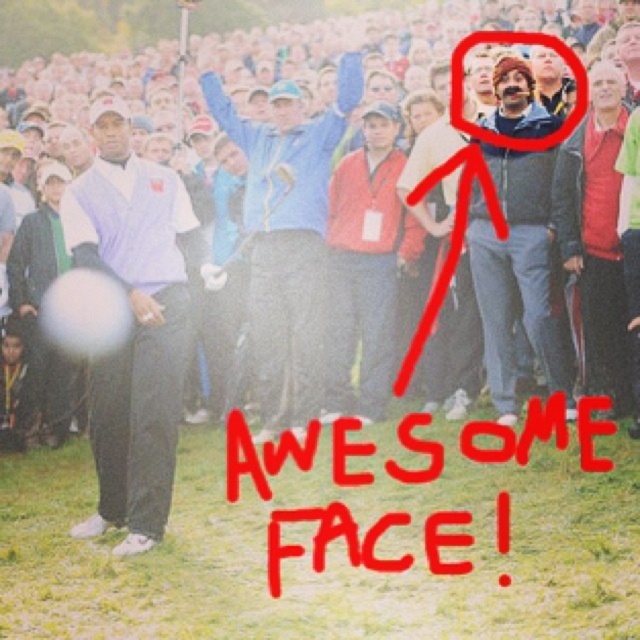
Based on the photo, you are standing in the middle of the scene and want to locate the white shirt at upper center. According to the coordinates given, in which direction should you look?

The white shirt at upper center is located at coordinates point (88, 97), so you should look towards the upper center direction.

You are a photographer at the golf event and want to capture a photo of the white shirt at upper center and the gray fleece jacket at upper right. Which one is more to the left in the image?

The white shirt at upper center is positioned on the left side of gray fleece jacket at upper right, so the white shirt at upper center is more to the left.

You are a photographer at the event and want to capture a photo that includes both the white shirt at upper center and the blue fabric jacket at center. Based on their positions, which one should you focus on first to ensure both are in frame?

You should focus on the blue fabric jacket at center first because the white shirt at upper center is located above it, so adjusting the frame to include the lower object first will naturally include the upper one as well.